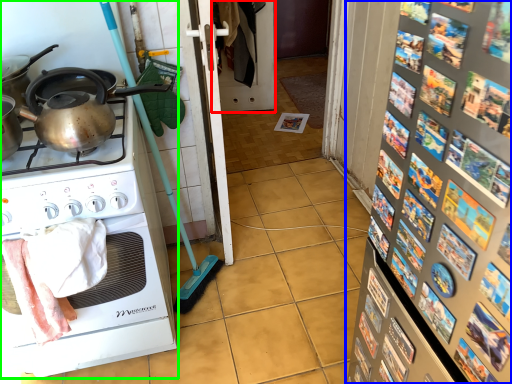
Question: Which object is the farthest from screen door (highlighted by a red box)? Choose among these: bulletin board (highlighted by a blue box) or home appliance (highlighted by a green box).

Choices:
 (A) bulletin board
 (B) home appliance

Answer: (A)